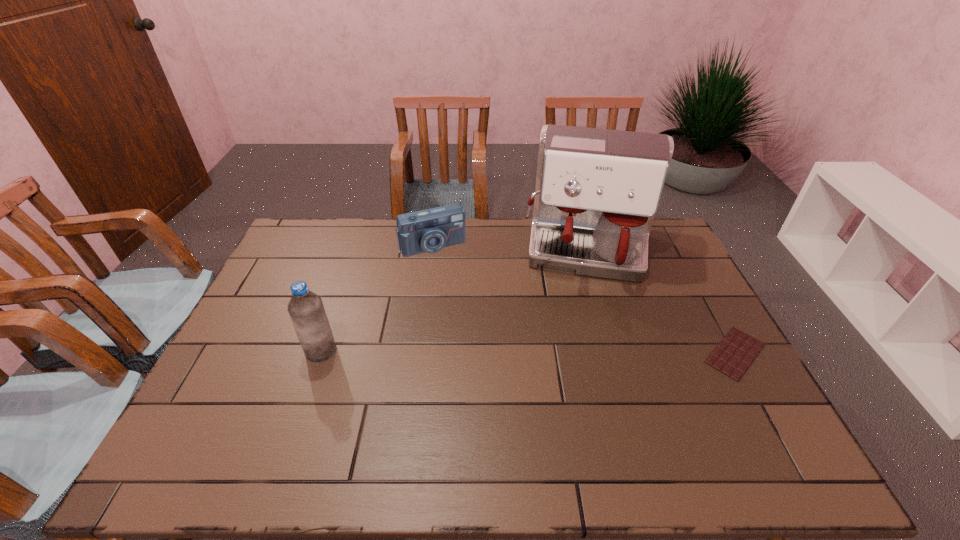
In the image, there is a desktop. Where is `vacant space at the near edge`? vacant space at the near edge is located at coordinates (406, 401).

This screenshot has width=960, height=540. Identify the location of vacant point at the left edge. (287, 326).

Find the location of a particular element. This screenshot has height=540, width=960. vacant space at the right edge of the desktop is located at coordinates (689, 294).

Where is `free space at the far right corner of the desktop`? Image resolution: width=960 pixels, height=540 pixels. free space at the far right corner of the desktop is located at coordinates (649, 247).

Where is `blank space at the near right corner`? Image resolution: width=960 pixels, height=540 pixels. blank space at the near right corner is located at coordinates (737, 400).

You are a GUI agent. You are given a task and a screenshot of the screen. Output one action in this format:
    pyautogui.click(x=<x>, y=<y>)
    Task: Click on the vacant point located between the shortest object and the second object from left to right
    This screenshot has width=960, height=540.
    Given the screenshot: What is the action you would take?
    pyautogui.click(x=584, y=299)

This screenshot has width=960, height=540. In order to click on free space between the coffee maker and the water bottle in this screenshot , I will do `click(454, 302)`.

Locate an element on the screen. The image size is (960, 540). vacant area that lies between the coffee maker and the third tallest object is located at coordinates (511, 249).

Locate an element on the screen. Image resolution: width=960 pixels, height=540 pixels. vacant area that lies between the third object from right to left and the coffee maker is located at coordinates (511, 249).

Where is `free space between the tallest object and the shortest object`? Image resolution: width=960 pixels, height=540 pixels. free space between the tallest object and the shortest object is located at coordinates (661, 303).